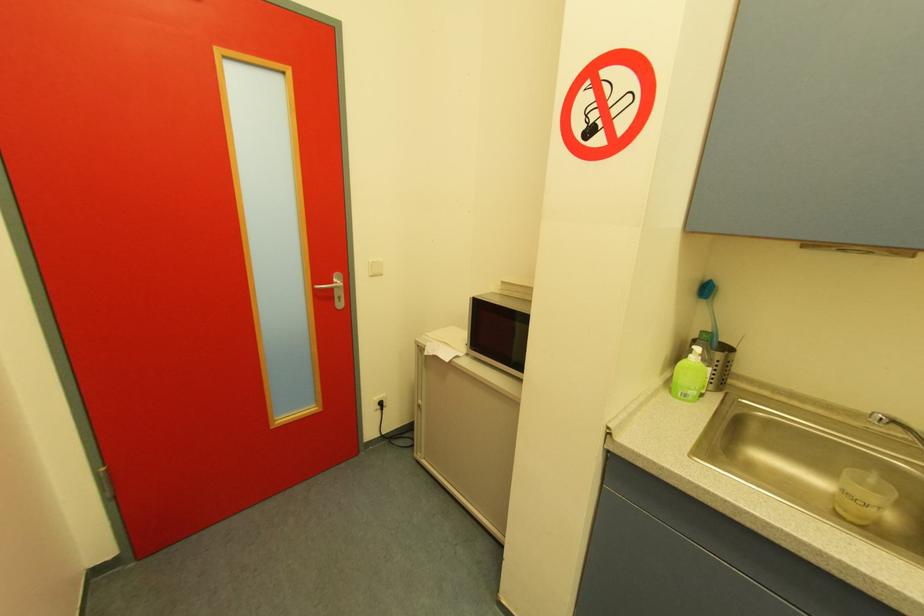
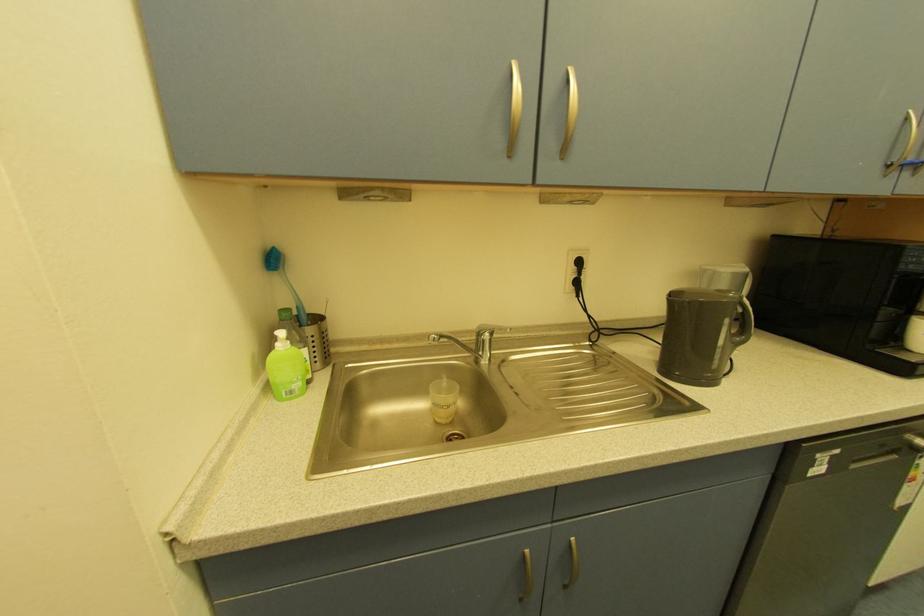
Question: The first image is from the beginning of the video and the second image is from the end. How did the camera likely rotate when shooting the video?

Choices:
 (A) Left
 (B) Right
 (C) Up
 (D) Down

Answer: (B)